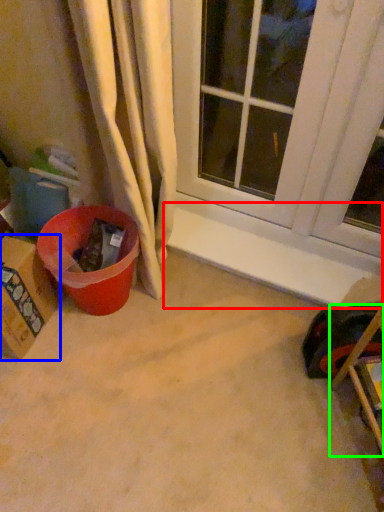
Question: Based on their relative distances, which object is nearer to window sill (highlighted by a red box)? Choose from cardboard box (highlighted by a blue box) and furniture (highlighted by a green box).

Choices:
 (A) cardboard box
 (B) furniture

Answer: (B)